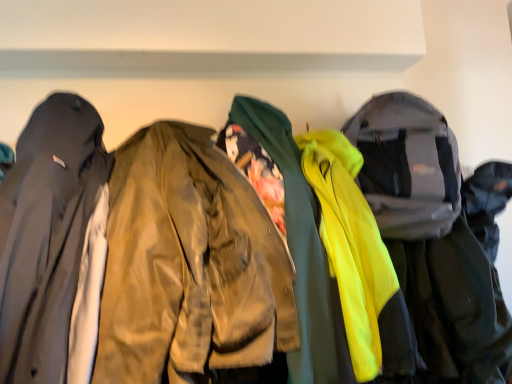
Question: Is neon yellow fabric jacket at right, the third jacket viewed from the left, further to the viewer compared to matte black jacket at left, the 1th jacket when ordered from left to right?

Choices:
 (A) yes
 (B) no

Answer: (A)

Question: Is neon yellow fabric jacket at right, the third jacket viewed from the left, next to matte black jacket at left, the 1th jacket when ordered from left to right, and touching it?

Choices:
 (A) no
 (B) yes

Answer: (A)

Question: From a real-world perspective, is neon yellow fabric jacket at right, the third jacket viewed from the left, below matte black jacket at left, the 1th jacket when ordered from left to right?

Choices:
 (A) yes
 (B) no

Answer: (A)

Question: Is matte black jacket at left, which is counted as the 3th jacket, starting from the right, at the back of neon yellow fabric jacket at right, acting as the 1th jacket starting from the right?

Choices:
 (A) yes
 (B) no

Answer: (B)

Question: Is matte black jacket at left, which is counted as the 3th jacket, starting from the right, surrounded by neon yellow fabric jacket at right, the third jacket viewed from the left?

Choices:
 (A) yes
 (B) no

Answer: (B)

Question: Considering their positions, is neon yellow fabric jacket at right, acting as the 1th jacket starting from the right, located in front of or behind matte black jacket at left, which is counted as the 3th jacket, starting from the right?

Choices:
 (A) behind
 (B) front

Answer: (A)

Question: Is neon yellow fabric jacket at right, acting as the 1th jacket starting from the right, taller or shorter than matte black jacket at left, the 1th jacket when ordered from left to right?

Choices:
 (A) tall
 (B) short

Answer: (A)

Question: Is point (414, 314) positioned closer to the camera than point (69, 269)?

Choices:
 (A) closer
 (B) farther

Answer: (B)

Question: Is neon yellow fabric jacket at right, acting as the 1th jacket starting from the right, wider or thinner than matte black jacket at left, the 1th jacket when ordered from left to right?

Choices:
 (A) wide
 (B) thin

Answer: (B)

Question: Is matte olive green jacket at center, placed as the 2th jacket when sorted from right to left, bigger or smaller than matte black jacket at left, the 1th jacket when ordered from left to right?

Choices:
 (A) small
 (B) big

Answer: (B)

Question: From the image's perspective, is matte olive green jacket at center, the second jacket in the left-to-right sequence, above or below matte black jacket at left, which is counted as the 3th jacket, starting from the right?

Choices:
 (A) below
 (B) above

Answer: (A)

Question: Choose the correct answer: Is matte olive green jacket at center, placed as the 2th jacket when sorted from right to left, inside matte black jacket at left, the 1th jacket when ordered from left to right, or outside it?

Choices:
 (A) outside
 (B) inside

Answer: (A)

Question: Looking at their shapes, would you say matte olive green jacket at center, the second jacket in the left-to-right sequence, is wider or thinner than matte black jacket at left, the 1th jacket when ordered from left to right?

Choices:
 (A) wide
 (B) thin

Answer: (B)

Question: From the image's perspective, is matte black jacket at left, which is counted as the 3th jacket, starting from the right, positioned above or below matte olive green jacket at center, placed as the 2th jacket when sorted from right to left?

Choices:
 (A) above
 (B) below

Answer: (A)

Question: Based on their sizes in the image, would you say matte black jacket at left, which is counted as the 3th jacket, starting from the right, is bigger or smaller than matte olive green jacket at center, placed as the 2th jacket when sorted from right to left?

Choices:
 (A) small
 (B) big

Answer: (A)